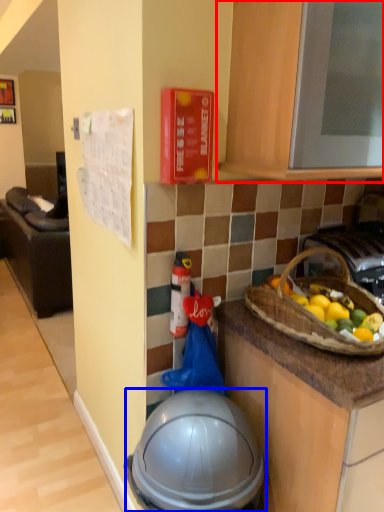
Question: Which point is closer to the camera, cabinetry (highlighted by a red box) or helmet (highlighted by a blue box)?

Choices:
 (A) cabinetry
 (B) helmet

Answer: (A)